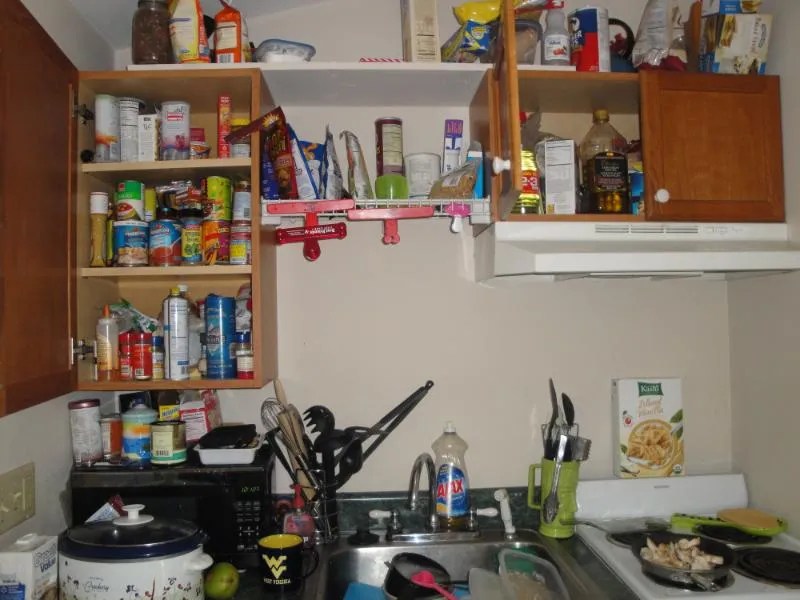
The image size is (800, 600). I want to click on tap handles, so click(486, 512), click(373, 511).